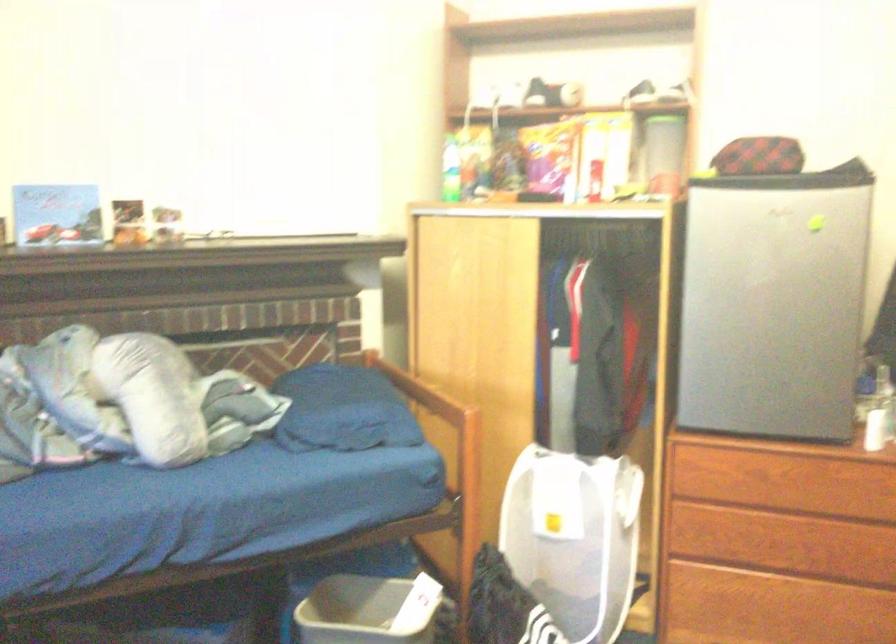
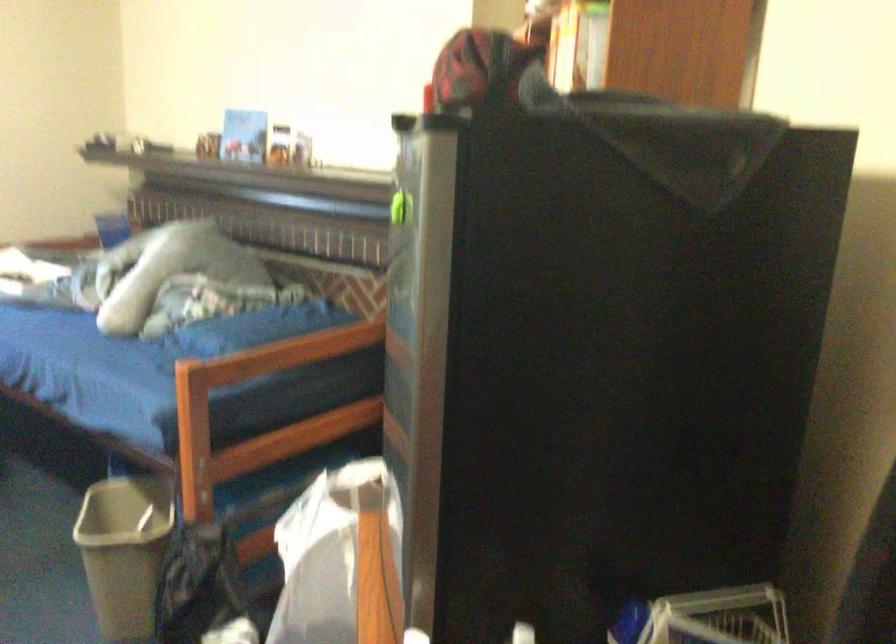
Question: I am providing you with two images of the same scene from different viewpoints. Please identify which objects are invisible in image2.

Choices:
 (A) clear plastic container
 (B) white stair railing
 (C) red and black cap
 (D) green magnetic clip

Answer: (A)